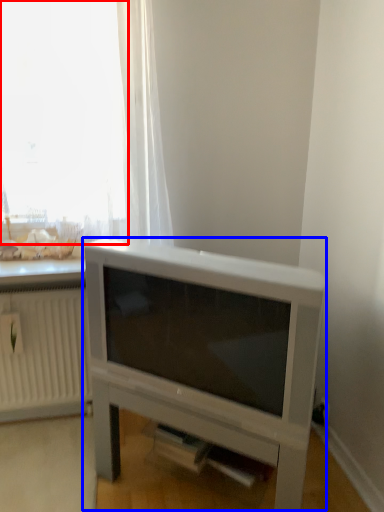
Question: Which point is closer to the camera, window (highlighted by a red box) or entertainment center (highlighted by a blue box)?

Choices:
 (A) window
 (B) entertainment center

Answer: (B)